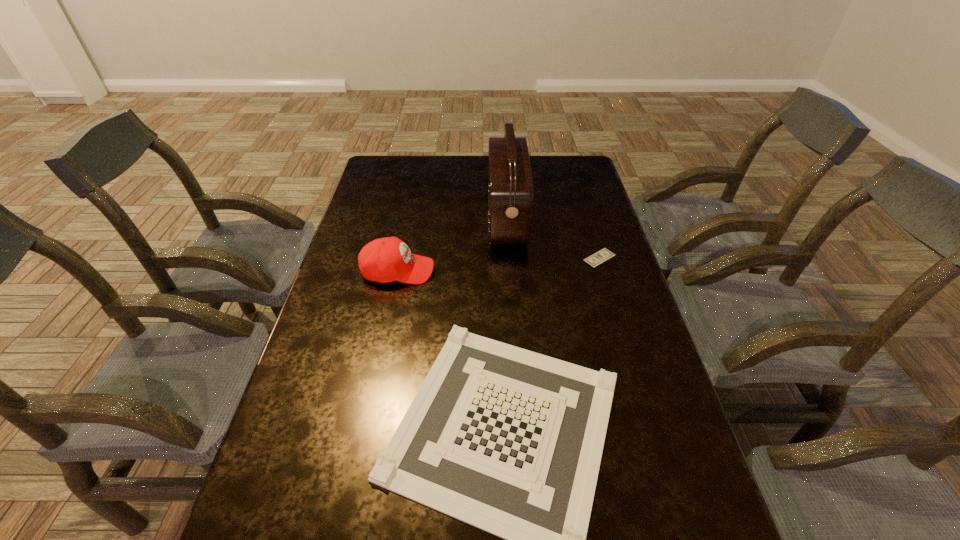
I want to click on free space between the money and the baseball cap, so click(499, 264).

This screenshot has height=540, width=960. Find the location of `vacant region between the tallest object and the shortest object`. vacant region between the tallest object and the shortest object is located at coordinates coord(553,239).

Find the location of a particular element. The height and width of the screenshot is (540, 960). object that is the closest to the nearest object is located at coordinates (388, 259).

I want to click on the second closest object to the radio receiver, so click(x=601, y=256).

This screenshot has width=960, height=540. I want to click on vacant space that satisfies the following two spatial constraints: 1. on the front panel of the radio receiver; 2. on the back side of the money, so click(x=509, y=258).

In order to click on vacant position in the image that satisfies the following two spatial constraints: 1. on the front panel of the tallest object; 2. on the right side of the money in this screenshot , I will do `click(509, 258)`.